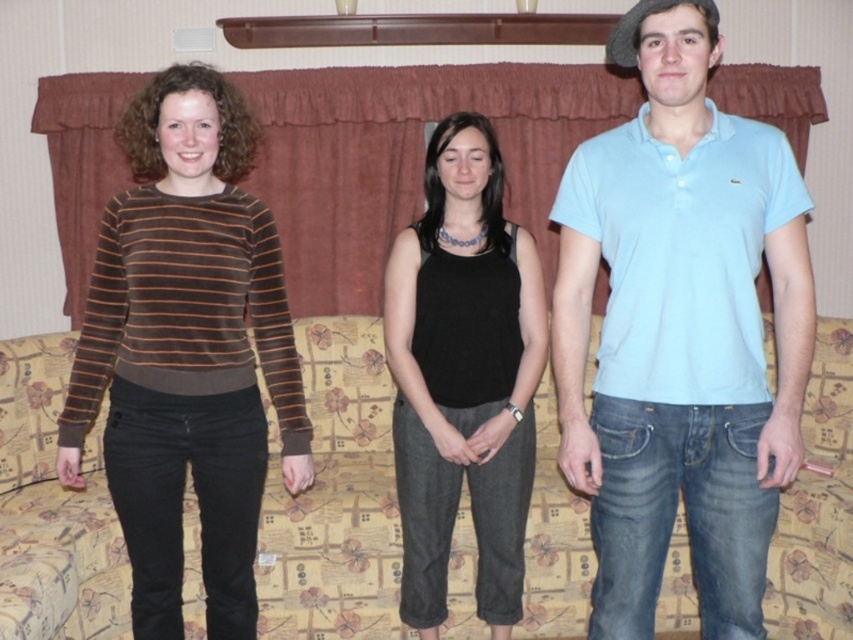
Question: Which point appears farthest from the camera in this image?

Choices:
 (A) (572, 500)
 (B) (384, 330)
 (C) (776, 392)
 (D) (137, 392)

Answer: (A)

Question: Where is floral-patterned fabric couch at center located in relation to black matte tank top at center in the image?

Choices:
 (A) left
 (B) right

Answer: (A)

Question: Which point is closer to the camera?

Choices:
 (A) light blue cotton polo shirt at right
 (B) black matte tank top at center
 (C) floral-patterned fabric couch at center
 (D) brown velvety sweater at left

Answer: (A)

Question: Can you confirm if light blue cotton polo shirt at right is positioned to the left of black matte tank top at center?

Choices:
 (A) yes
 (B) no

Answer: (B)

Question: Which point is closer to the camera?

Choices:
 (A) (215, 557)
 (B) (471, 342)

Answer: (A)

Question: Does light blue cotton polo shirt at right appear on the left side of black matte tank top at center?

Choices:
 (A) yes
 (B) no

Answer: (B)